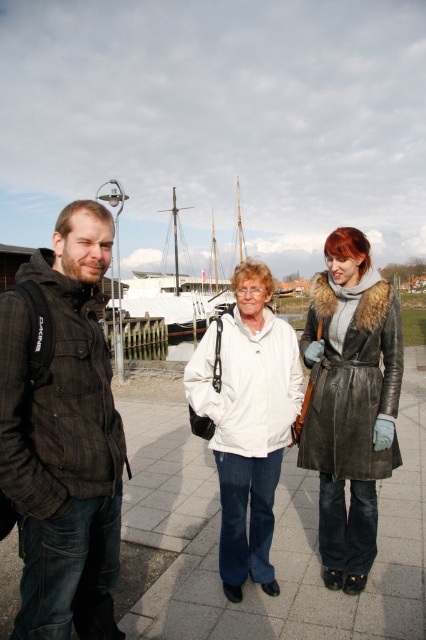
Question: Which object is positioned closest to the white matte jacket at center?

Choices:
 (A) leather coat at center
 (B) dark brown plaid jacket at left

Answer: (A)

Question: Which point is closer to the camera taking this photo?

Choices:
 (A) (232, 440)
 (B) (58, 236)
 (C) (356, 529)

Answer: (B)

Question: Can you confirm if dark brown plaid jacket at left is positioned below white matte jacket at center?

Choices:
 (A) no
 (B) yes

Answer: (A)

Question: In this image, where is dark brown plaid jacket at left located relative to leather coat at center?

Choices:
 (A) above
 (B) below

Answer: (B)

Question: Among these points, which one is farthest from the camera?

Choices:
 (A) (37, 525)
 (B) (350, 312)
 (C) (244, 433)

Answer: (B)

Question: Does leather coat at center appear on the right side of white matte jacket at center?

Choices:
 (A) yes
 (B) no

Answer: (A)